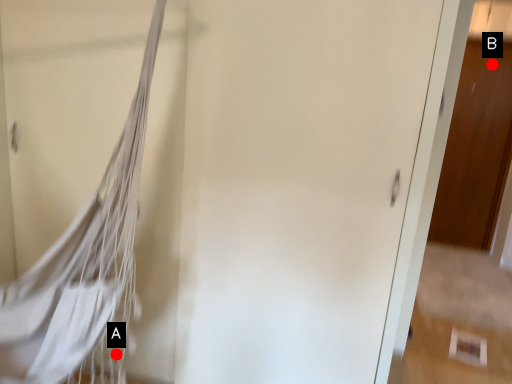
Question: Two points are circled on the image, labeled by A and B beside each circle. Which of the following is the farthest from the observer?

Choices:
 (A) A is further
 (B) B is further

Answer: (B)